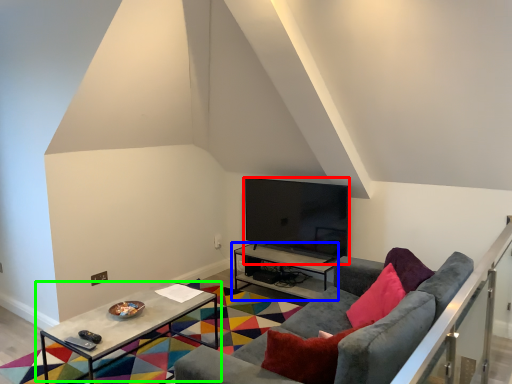
Question: Which is nearer to the television (highlighted by a red box)? table (highlighted by a blue box) or table (highlighted by a green box).

Choices:
 (A) table
 (B) table

Answer: (A)